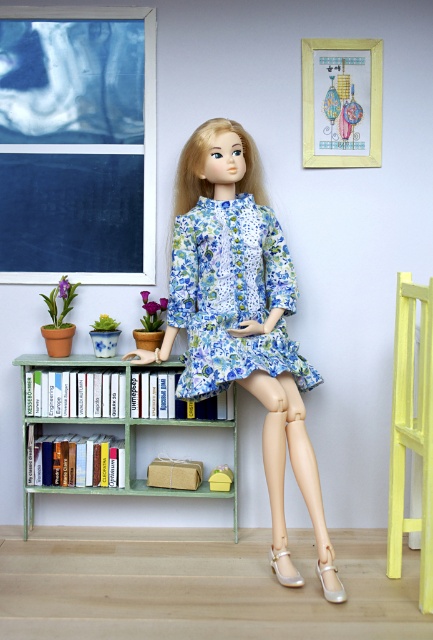
Consider the image. You are a photographer trying to capture the green painted wood bookshelf at lower center in a portrait. The camera you are using has a fixed focus point at coordinate 0.664, 0.224. Will the bookshelf be in focus?

The 2D location of the green painted wood bookshelf at lower center is at point [96,424], so yes, the bookshelf will be in focus because the camera focus point matches its coordinates.